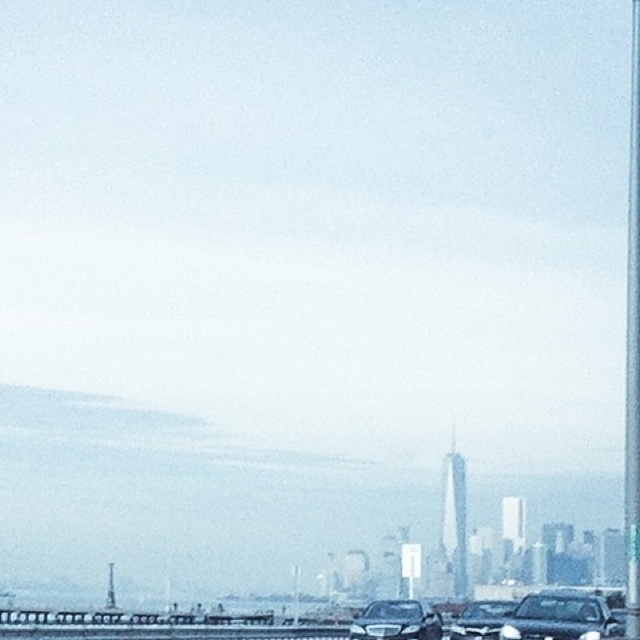
You are a city planner reviewing this image for potential new installations. You notice a point marked at coordinates (x=632, y=349). What object does this point likely correspond to?

The point at coordinates (x=632, y=349) corresponds to the metallic pole at right.

You are driving a car and want to park in the parking lot near the shiny black sedan at lower right and the sleek black car at lower right. Which one is closer to the parking lot entrance?

The shiny black sedan at lower right is closer to the parking lot entrance because it is positioned to the left of the sleek black car at lower right, and parking lots typically have entrances on the left side.

You are standing next to the shiny black sedan at lower right and want to take a photo of the city skyline. The camera is 40.42 meters away from the sedan. Considering the haze in the scene, do you think the camera is close enough to capture a clear photo of the skyline?

The camera is 40.42 meters away from the shiny black sedan at lower right. However, the haze in the scene obscures much of the detail, making it difficult to capture a clear photo of the skyline even at that distance.